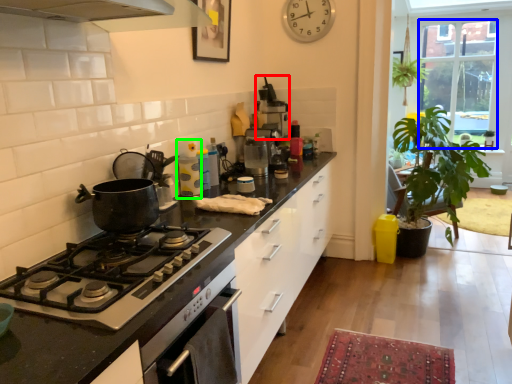
Question: Which is nearer to the appliance (highlighted by a red box)? window (highlighted by a blue box) or appliance (highlighted by a green box).

Choices:
 (A) window
 (B) appliance

Answer: (B)